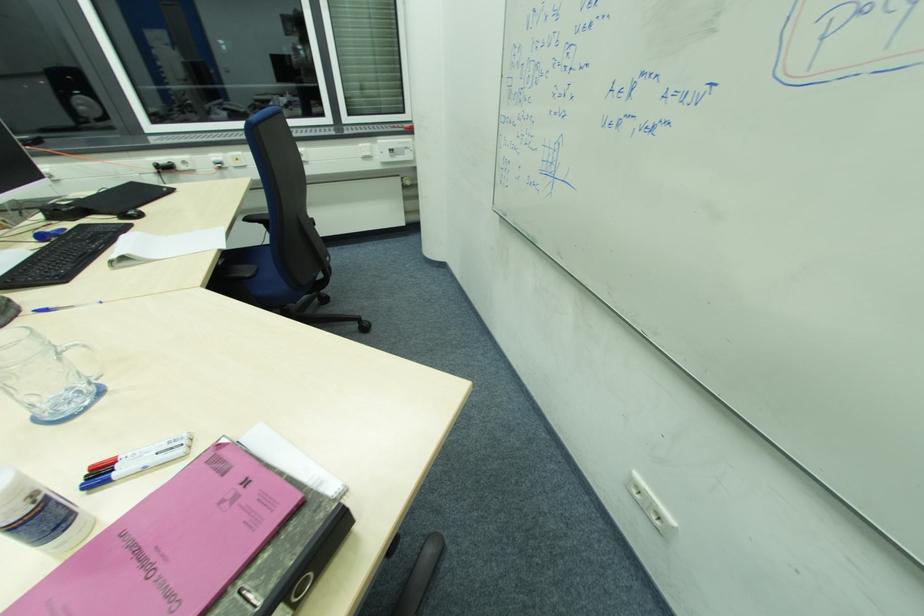
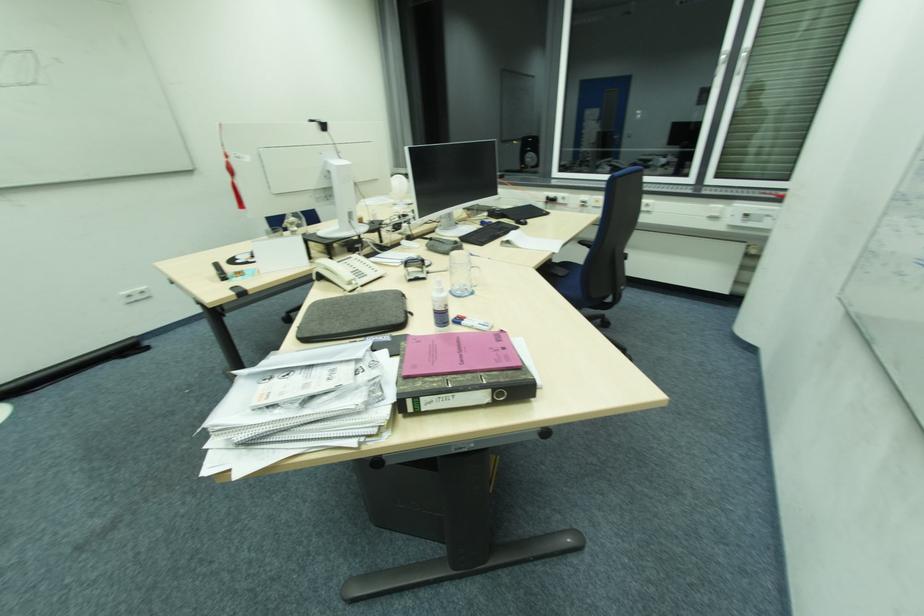
Locate, in the second image, the point that corresponds to point 148,467 in the first image.

(477, 326)